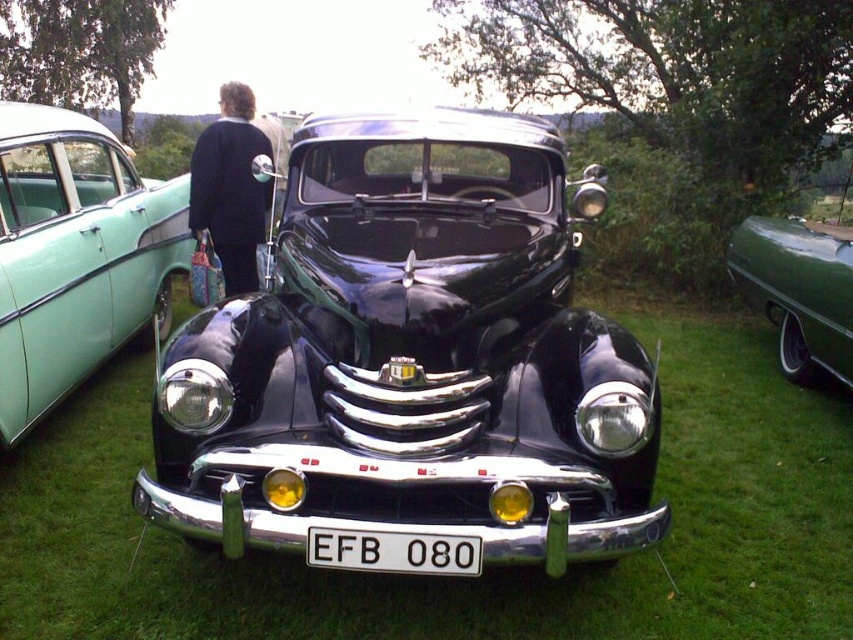
Question: Can you confirm if teal glossy sedan at left is bigger than green glossy car at right?

Choices:
 (A) yes
 (B) no

Answer: (A)

Question: Can you confirm if shiny black car at center is positioned above teal glossy sedan at left?

Choices:
 (A) no
 (B) yes

Answer: (A)

Question: Which point is closer to the camera taking this photo?

Choices:
 (A) (405, 552)
 (B) (30, 257)

Answer: (A)

Question: Which of the following is the farthest from the observer?

Choices:
 (A) (238, 260)
 (B) (111, 392)

Answer: (A)

Question: Which is farther from the shiny black car at center?

Choices:
 (A) white plastic license plate at center
 (B) teal glossy sedan at left

Answer: (B)

Question: Is green glossy car at right positioned before black fabric bag at left?

Choices:
 (A) yes
 (B) no

Answer: (A)